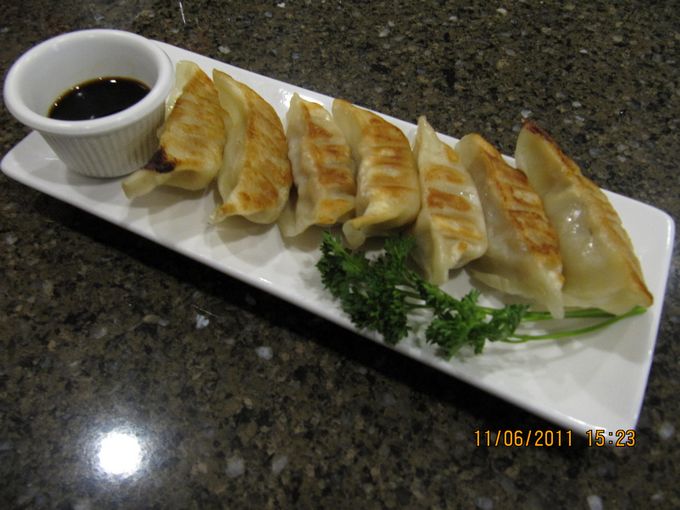
Where is `table`? table is located at coordinates [338, 416].